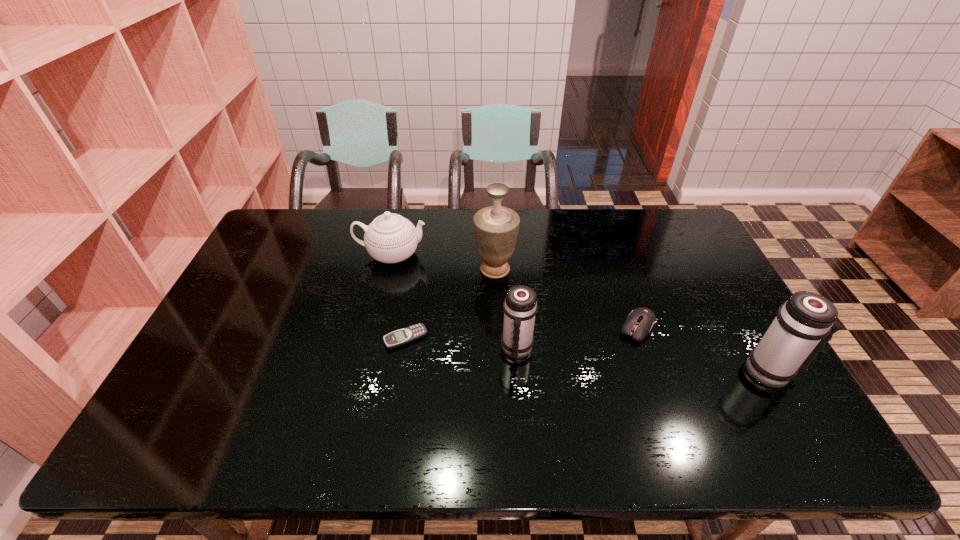
I want to click on the fourth shortest object, so click(520, 306).

You are a GUI agent. You are given a task and a screenshot of the screen. Output one action in this format:
    pyautogui.click(x=<x>, y=<y>)
    Task: Click on the shorter thermos bottle
    
    Given the screenshot: What is the action you would take?
    tap(520, 306)

Find the location of a particular element. This screenshot has height=540, width=960. the rightmost object is located at coordinates (803, 325).

Identify the location of the second tallest object. This screenshot has height=540, width=960. (803, 325).

You are a GUI agent. You are given a task and a screenshot of the screen. Output one action in this format:
    pyautogui.click(x=<x>, y=<y>)
    Task: Click on the fourth tallest object
    The image size is (960, 540).
    Given the screenshot: What is the action you would take?
    pyautogui.click(x=390, y=238)

In order to click on computer mouse in this screenshot , I will do `click(640, 322)`.

Find the location of a particular element. The image size is (960, 540). the second object from right to left is located at coordinates 640,322.

Find the location of a particular element. beeper is located at coordinates (406, 335).

You are a GUI agent. You are given a task and a screenshot of the screen. Output one action in this format:
    pyautogui.click(x=<x>, y=<y>)
    Task: Click on the urn
    The width and height of the screenshot is (960, 540).
    Given the screenshot: What is the action you would take?
    pyautogui.click(x=496, y=227)

At what (x,y) coordinates should I click in order to perform the action: click on free space located 0.110m on the side with the handle of the left thermos bottle. Please return your answer as a coordinate pair (x, y). Looking at the image, I should click on (521, 402).